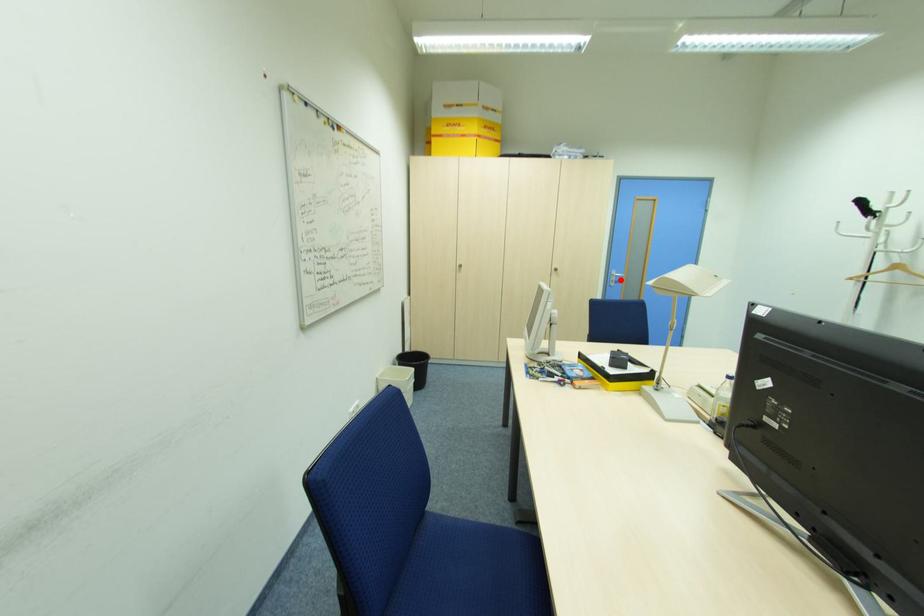
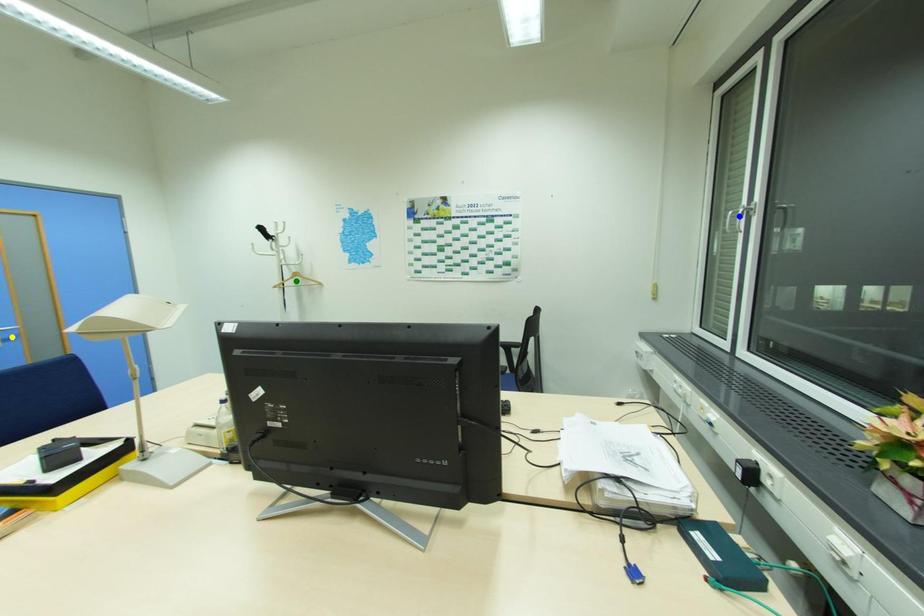
Question: I am providing you with two images of the same scene from different viewpoints. A red point is marked on the first image. You are given multiple points on the second image. Which spot in image 2 lines up with the point in image 1?

Choices:
 (A) yellow point
 (B) green point
 (C) blue point

Answer: (A)